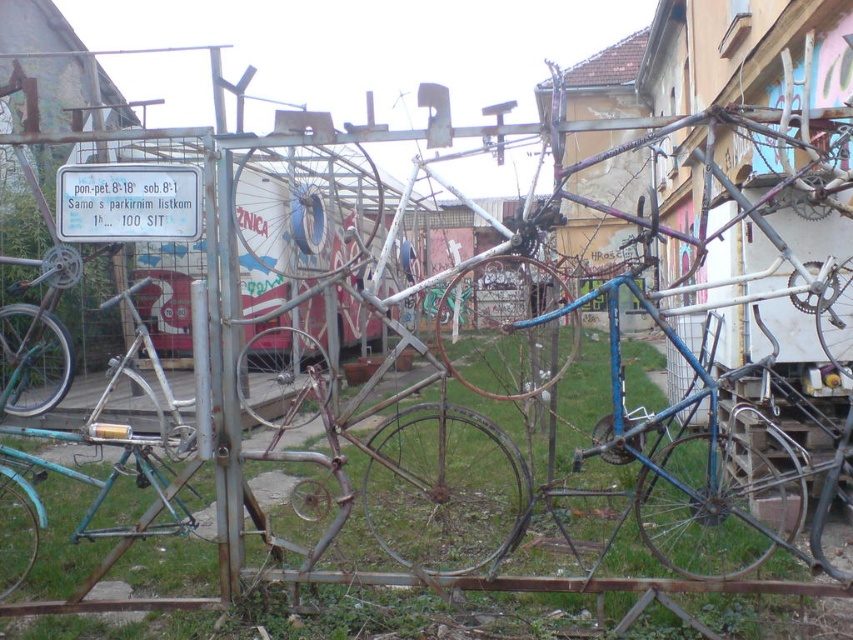
Question: Which of the following is the closest to the observer?

Choices:
 (A) (79, 204)
 (B) (48, 376)

Answer: (A)

Question: Which point is farther from the camera taking this photo?

Choices:
 (A) (62, 378)
 (B) (86, 204)

Answer: (B)

Question: Can you confirm if white plastic sign at upper left is wider than brushed metal bicycle at left?

Choices:
 (A) no
 (B) yes

Answer: (A)

Question: Can you confirm if white plastic sign at upper left is positioned to the right of brushed metal bicycle at left?

Choices:
 (A) yes
 (B) no

Answer: (A)

Question: Does white plastic sign at upper left have a greater width compared to brushed metal bicycle at left?

Choices:
 (A) no
 (B) yes

Answer: (A)